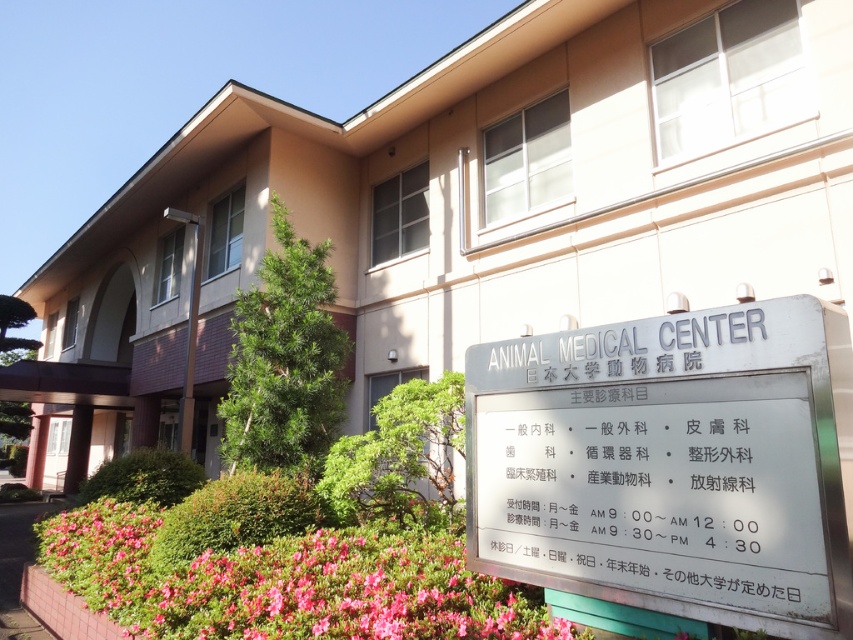
Which is more to the right, silver metallic sign at center or pink matte flowers at lower left?

From the viewer's perspective, silver metallic sign at center appears more on the right side.

Where is `silver metallic sign at center`? silver metallic sign at center is located at coordinates (672, 465).

Between silver metallic sign at center and metallic signboard at center, which one has more height?

With more height is silver metallic sign at center.

Between silver metallic sign at center and metallic signboard at center, which one has less height?

metallic signboard at center

Which is behind, point (648, 540) or point (698, 545)?

Positioned behind is point (648, 540).

Where is `silver metallic sign at center`? Image resolution: width=853 pixels, height=640 pixels. silver metallic sign at center is located at coordinates (672, 465).

Looking at this image, which is more to the right, metallic signboard at center or pink matte flowers at lower left?

From the viewer's perspective, metallic signboard at center appears more on the right side.

Can you confirm if metallic signboard at center is shorter than pink matte flowers at lower left?

No.

What do you see at coordinates (659, 499) in the screenshot? This screenshot has width=853, height=640. I see `metallic signboard at center` at bounding box center [659, 499].

Identify the location of metallic signboard at center. (659, 499).